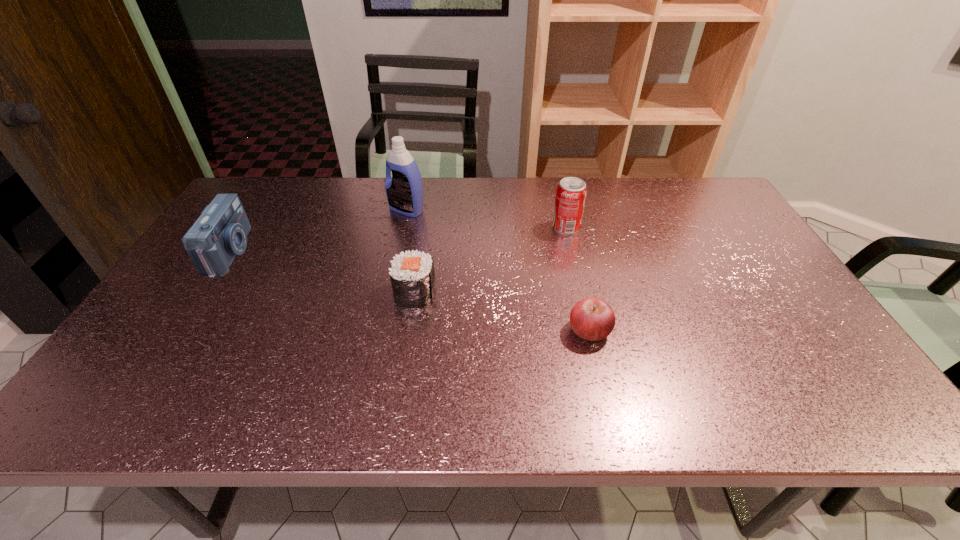
This screenshot has height=540, width=960. I want to click on vacant space situated on the right of the sushi, so click(x=504, y=293).

At what (x,y) coordinates should I click in order to perform the action: click on vacant area situated on the left of the nearest object. Please return your answer as a coordinate pair (x, y). Looking at the image, I should click on (444, 330).

I want to click on object positioned at the far edge, so click(x=404, y=190).

At what (x,y) coordinates should I click in order to perform the action: click on object positioned at the left edge. Please return your answer as a coordinate pair (x, y). The image size is (960, 540). Looking at the image, I should click on (220, 233).

In the image, there is a desktop. Where is `free space at the far edge`? free space at the far edge is located at coordinates (448, 188).

You are a GUI agent. You are given a task and a screenshot of the screen. Output one action in this format:
    pyautogui.click(x=<x>, y=<y>)
    Task: Click on the vacant space at the near edge
    
    Given the screenshot: What is the action you would take?
    pyautogui.click(x=268, y=402)

Identify the location of vacant space at the left edge. (197, 274).

You are a GUI agent. You are given a task and a screenshot of the screen. Output one action in this format:
    pyautogui.click(x=<x>, y=<y>)
    Task: Click on the vacant area at the right edge
    Image resolution: width=960 pixels, height=540 pixels.
    Given the screenshot: What is the action you would take?
    pyautogui.click(x=820, y=334)

You are a GUI agent. You are given a task and a screenshot of the screen. Output one action in this format:
    pyautogui.click(x=<x>, y=<y>)
    Task: Click on the free spot at the far left corner of the desktop
    
    Given the screenshot: What is the action you would take?
    pyautogui.click(x=290, y=183)

You are a GUI agent. You are given a task and a screenshot of the screen. Output one action in this format:
    pyautogui.click(x=<x>, y=<y>)
    Task: Click on the vacant area that lies between the soda can and the third shortest object
    Image resolution: width=960 pixels, height=540 pixels.
    Given the screenshot: What is the action you would take?
    pyautogui.click(x=398, y=240)